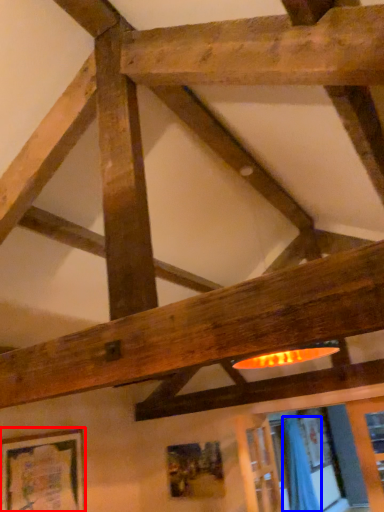
Question: Which point is closer to the camera, picture frame (highlighted by a red box) or curtain (highlighted by a blue box)?

Choices:
 (A) picture frame
 (B) curtain

Answer: (A)